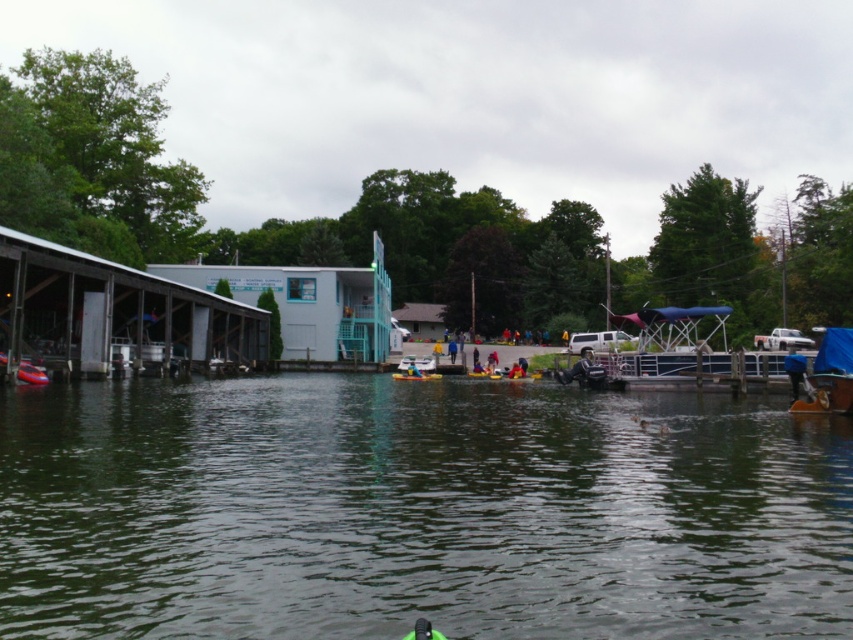
You are standing at the camera position and want to reach the point marked as point (816, 388). Can you walk directly to it without crossing any water? Please explain your reasoning based on the scene description.

The point (816, 388) is 21.92 meters away from the camera. Since the scene describes a lakeside with a covered dock on the left and calm water in the foreground, it is likely that the path to this point would require crossing the water unless there is a visible structure like the dock. However, the dock is on the left side, and the point coordinates might be in the water area. Without specific structures mentioned for that exact point, walking directly might not be possible.

You are planning to take a short trip on the lake and have both the blue tarpaulin boat at lower right and the yellow fabric kayak at center available. Which one can accommodate more passengers?

The blue tarpaulin boat at lower right has a larger size compared to the yellow fabric kayak at center, so it can accommodate more passengers.

You are standing at the lakeside and want to take a photo of the small building with light blue walls and white trim. There are two points marked in the image at coordinates point (833, 340) and point (410, 372). Which point should you focus on to ensure the building is in sharp focus?

You should focus on point (833, 340) because it is closer to the camera than point (410, 372), making it the correct point for sharp focus on the building.